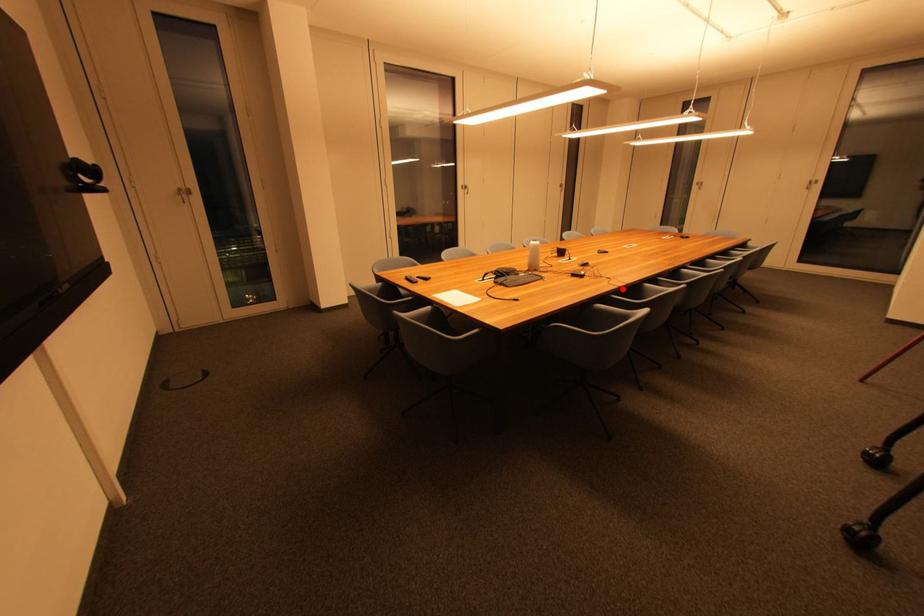
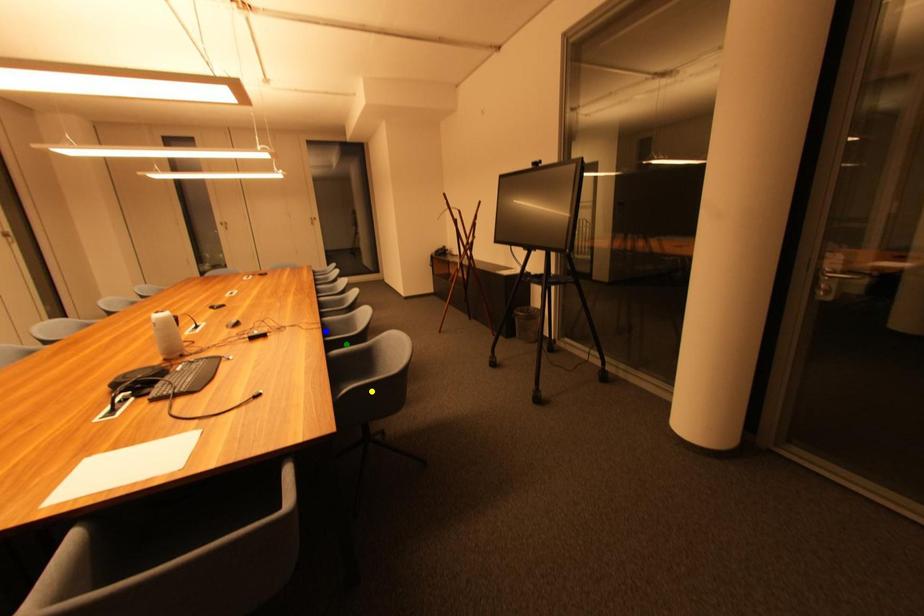
Question: I am providing you with two images of the same scene from different viewpoints. A red point is marked on the first image. You are given multiple points on the second image. Which point in image 2 represents the same 3d spot as the red point in image 1?

Choices:
 (A) green point
 (B) yellow point
 (C) blue point

Answer: (C)